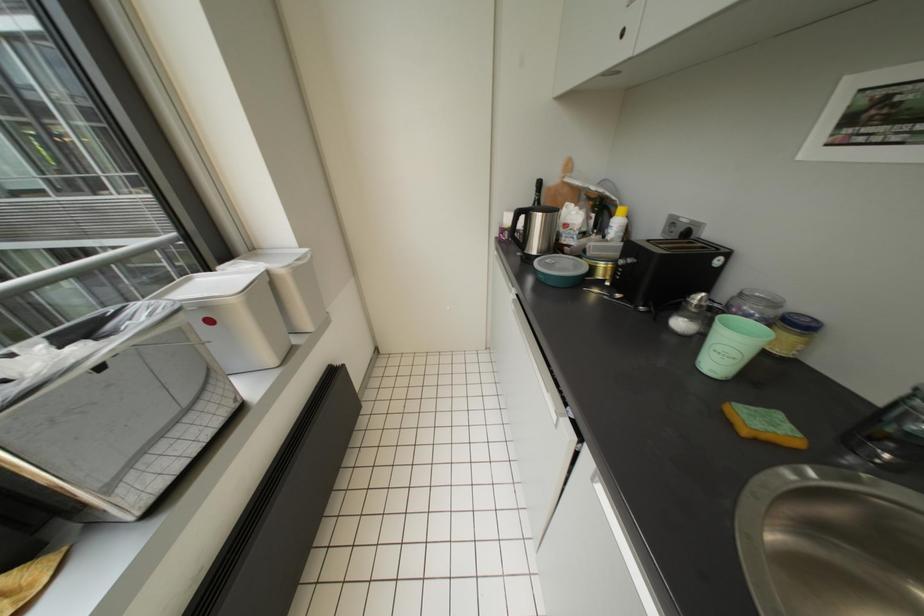
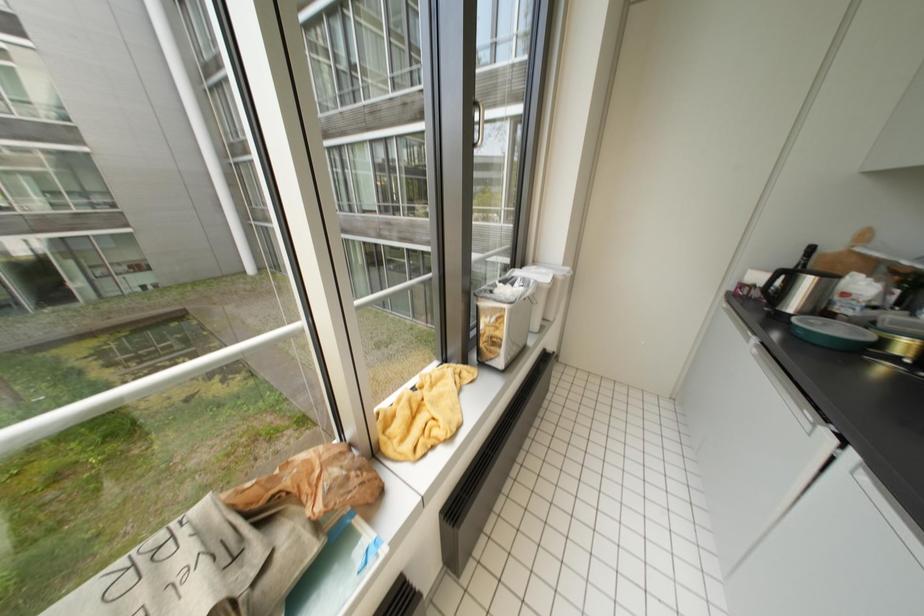
Question: How did the camera likely rotate?

Choices:
 (A) Left
 (B) Right
 (C) Up
 (D) Down

Answer: (A)